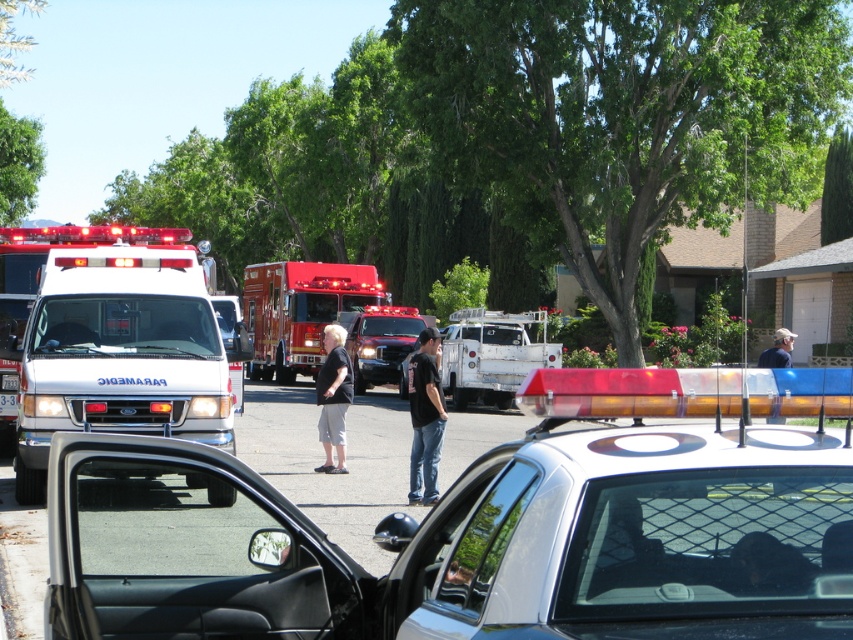
Question: Does white glossy police car at center have a smaller size compared to light blue jeans at center?

Choices:
 (A) no
 (B) yes

Answer: (B)

Question: Does red metallic fire truck at center appear over white glossy ambulance at center?

Choices:
 (A) yes
 (B) no

Answer: (A)

Question: Estimate the real-world distances between objects in this image. Which object is closer to the light blue jeans at center?

Choices:
 (A) white matte truck at center
 (B) white glossy ambulance at center
 (C) white glossy police car at center

Answer: (A)

Question: From the image, what is the correct spatial relationship of white glossy ambulance at center in relation to light blue jeans at center?

Choices:
 (A) right
 (B) left

Answer: (B)

Question: Which point is farther to the camera?

Choices:
 (A) black cotton shirt at center
 (B) red metallic fire truck at center

Answer: (B)

Question: Considering the real-world distances, which object is farthest from the light blue jeans at center?

Choices:
 (A) black cotton shorts at center
 (B) black cotton shirt at center
 (C) white glossy ambulance at left

Answer: (C)